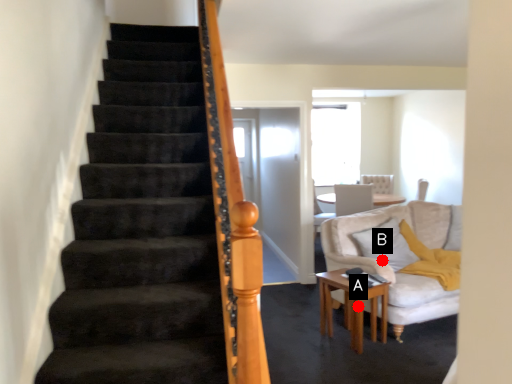
Question: Two points are circled on the image, labeled by A and B beside each circle. Which point is closer to the camera taking this photo?

Choices:
 (A) A is closer
 (B) B is closer

Answer: (A)